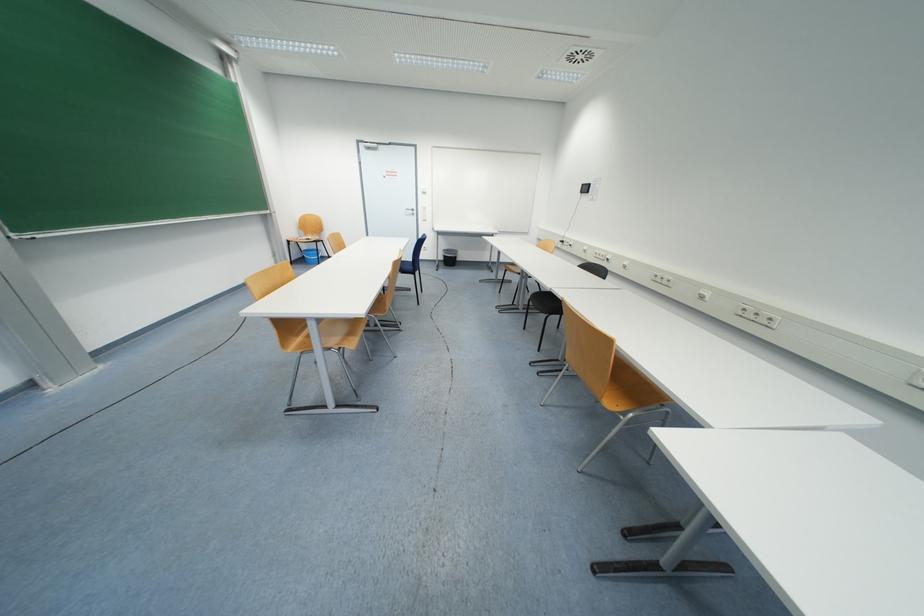
Describe the element at coordinates (545, 302) in the screenshot. Image resolution: width=924 pixels, height=616 pixels. I see `the black chair sitting surface` at that location.